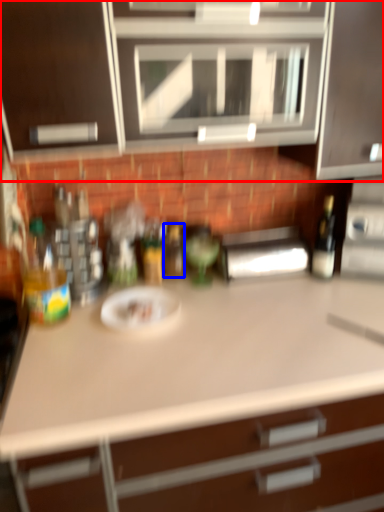
Question: Which object appears farthest to the camera in this image, cabinetry (highlighted by a red box) or bottle (highlighted by a blue box)?

Choices:
 (A) cabinetry
 (B) bottle

Answer: (B)